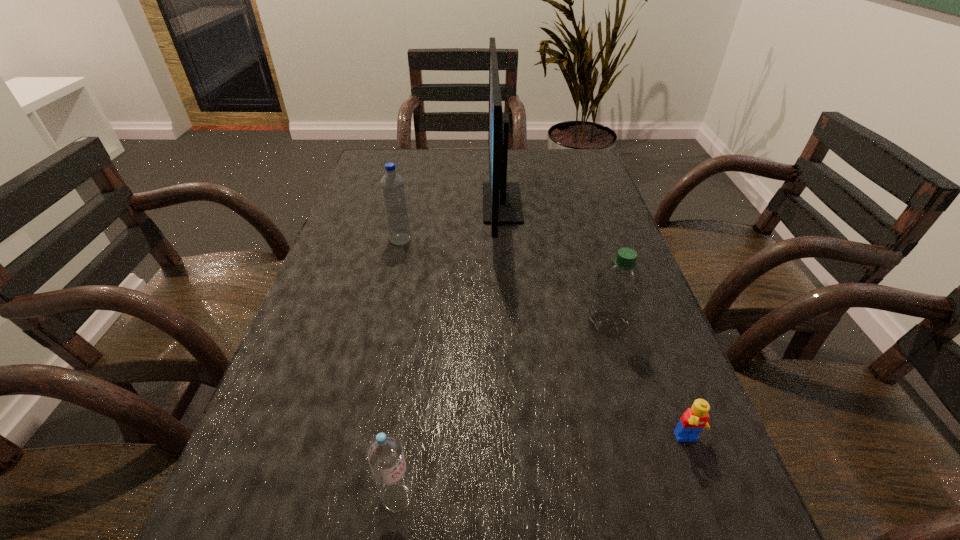
Identify the location of Lego that is at the right edge. The image size is (960, 540). (694, 420).

Where is `vacant area at the far edge of the desktop`? Image resolution: width=960 pixels, height=540 pixels. vacant area at the far edge of the desktop is located at coordinates (483, 163).

Where is `blank space at the left edge of the desktop`? The image size is (960, 540). blank space at the left edge of the desktop is located at coordinates click(299, 439).

In the image, there is a desktop. At what (x,y) coordinates should I click in order to perform the action: click on vacant space at the right edge. Please return your answer as a coordinate pair (x, y). Looking at the image, I should click on (625, 515).

Image resolution: width=960 pixels, height=540 pixels. I want to click on vacant space at the far left corner, so click(412, 176).

Identify the location of vacant space at the far right corner of the desktop. (583, 173).

I want to click on free space between the shortest object and the second water bottle from left to right, so click(542, 469).

Identify the location of vacant space in between the fourth farthest object and the farthest water bottle. Image resolution: width=960 pixels, height=540 pixels. (544, 340).

At what (x,y) coordinates should I click in order to perform the action: click on unoccupied area between the rightmost water bottle and the leftmost object. Please return your answer as a coordinate pair (x, y). Looking at the image, I should click on coord(505,282).

Find the location of a particular element. Image resolution: width=960 pixels, height=540 pixels. vacant space that is in between the second object from right to left and the farthest water bottle is located at coordinates (505, 282).